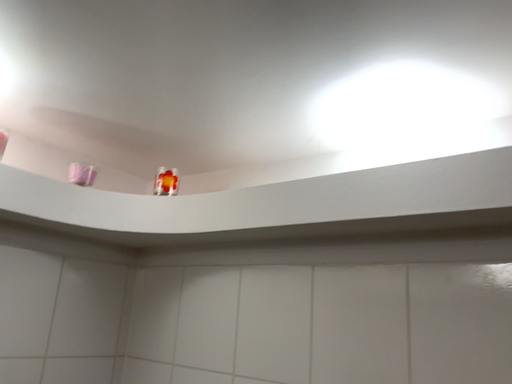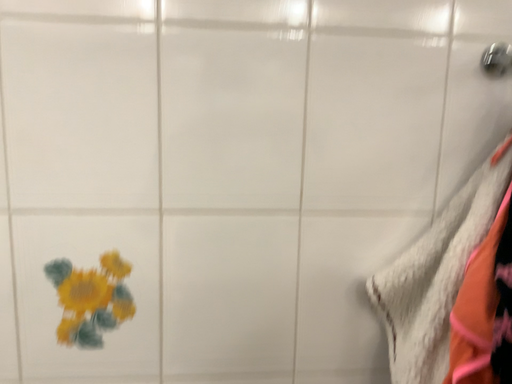
Question: Which way did the camera rotate in the video?

Choices:
 (A) rotated left
 (B) rotated right

Answer: (B)